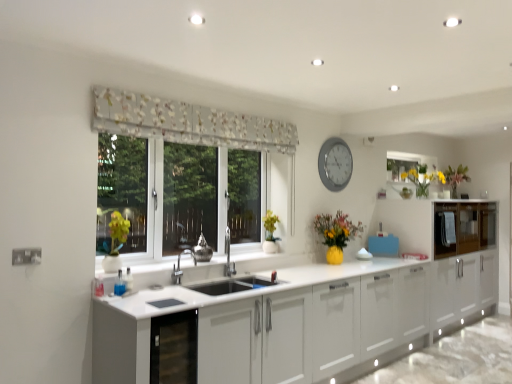
Question: Considering the relative positions of glossy wood cabinets at right and floral fabric curtain at upper center in the image provided, is glossy wood cabinets at right behind floral fabric curtain at upper center?

Choices:
 (A) yes
 (B) no

Answer: (A)

Question: Is glossy wood cabinets at right next to floral fabric curtain at upper center?

Choices:
 (A) yes
 (B) no

Answer: (B)

Question: Is glossy wood cabinets at right smaller than floral fabric curtain at upper center?

Choices:
 (A) no
 (B) yes

Answer: (A)

Question: Is glossy wood cabinets at right wider than floral fabric curtain at upper center?

Choices:
 (A) no
 (B) yes

Answer: (B)

Question: From a real-world perspective, is glossy wood cabinets at right physically below floral fabric curtain at upper center?

Choices:
 (A) yes
 (B) no

Answer: (A)

Question: Is glossy wood cabinets at right taller than floral fabric curtain at upper center?

Choices:
 (A) no
 (B) yes

Answer: (B)

Question: Considering the relative sizes of metallic silver vase at center and floral fabric curtain at upper center in the image provided, is metallic silver vase at center thinner than floral fabric curtain at upper center?

Choices:
 (A) yes
 (B) no

Answer: (B)

Question: Is metallic silver vase at center bigger than floral fabric curtain at upper center?

Choices:
 (A) yes
 (B) no

Answer: (B)

Question: From a real-world perspective, is metallic silver vase at center physically below floral fabric curtain at upper center?

Choices:
 (A) no
 (B) yes

Answer: (B)

Question: Are metallic silver vase at center and floral fabric curtain at upper center making contact?

Choices:
 (A) yes
 (B) no

Answer: (B)

Question: Is there a large distance between metallic silver vase at center and floral fabric curtain at upper center?

Choices:
 (A) no
 (B) yes

Answer: (A)

Question: Is metallic silver vase at center taller than floral fabric curtain at upper center?

Choices:
 (A) yes
 (B) no

Answer: (B)

Question: Can you confirm if floral fabric curtain at upper center is taller than glossy wood cabinets at right?

Choices:
 (A) no
 (B) yes

Answer: (A)